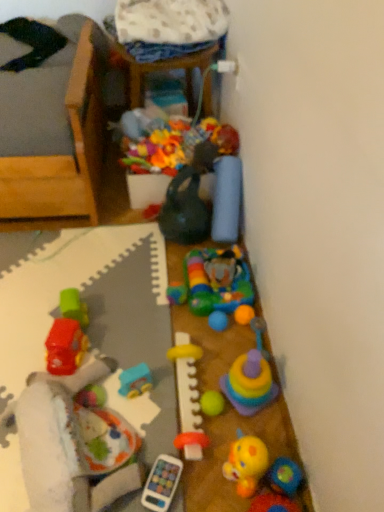
Find the location of a particular element. vacant space situated on the left part of green rubber ball at center, which is counted as the 7th toy, starting from the right is located at coordinates (161, 403).